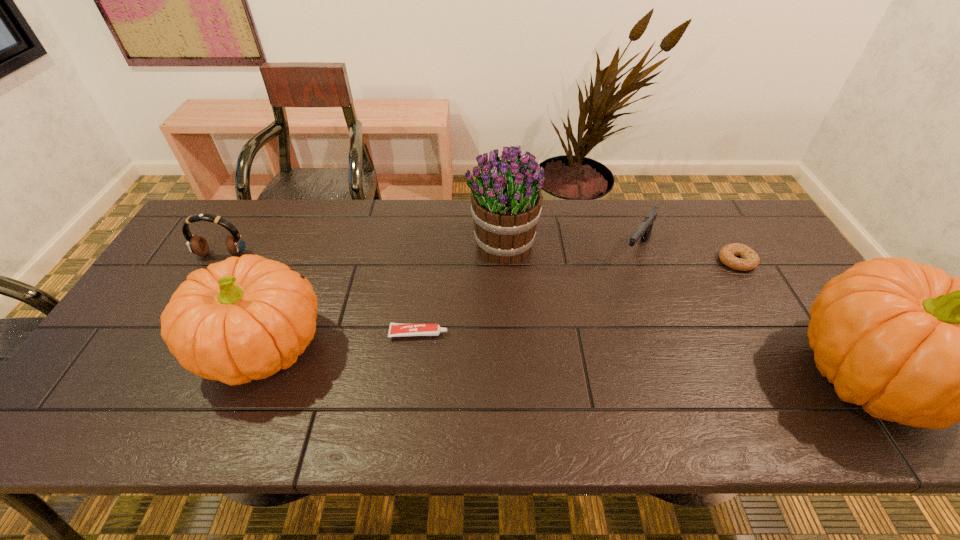
Find the location of `vacant region between the headset and the fourth object from left to right`. vacant region between the headset and the fourth object from left to right is located at coordinates (363, 250).

Image resolution: width=960 pixels, height=540 pixels. I want to click on vacant area that lies between the bagel and the fourth shortest object, so click(480, 258).

At what (x,y) coordinates should I click in order to perform the action: click on unoccupied position between the bagel and the fifth object from left to right. Please return your answer as a coordinate pair (x, y). The image size is (960, 540). Looking at the image, I should click on (686, 256).

You are a GUI agent. You are given a task and a screenshot of the screen. Output one action in this format:
    pyautogui.click(x=<x>, y=<y>)
    Task: Click on the free space that is in between the gun and the fifth shortest object
    This screenshot has width=960, height=540.
    Given the screenshot: What is the action you would take?
    pyautogui.click(x=450, y=299)

At what (x,y) coordinates should I click in order to perform the action: click on object that is the sixth closest to the fourth object from left to right. Please return your answer as a coordinate pair (x, y). The image size is (960, 540). Looking at the image, I should click on (197, 244).

This screenshot has height=540, width=960. I want to click on the third closest object relative to the shorter pumpkin, so click(506, 198).

Where is `vacant area that satisfies the following two spatial constraints: 1. on the ear cup of the bagel; 2. on the left side of the leftmost object`? This screenshot has height=540, width=960. vacant area that satisfies the following two spatial constraints: 1. on the ear cup of the bagel; 2. on the left side of the leftmost object is located at coordinates (219, 261).